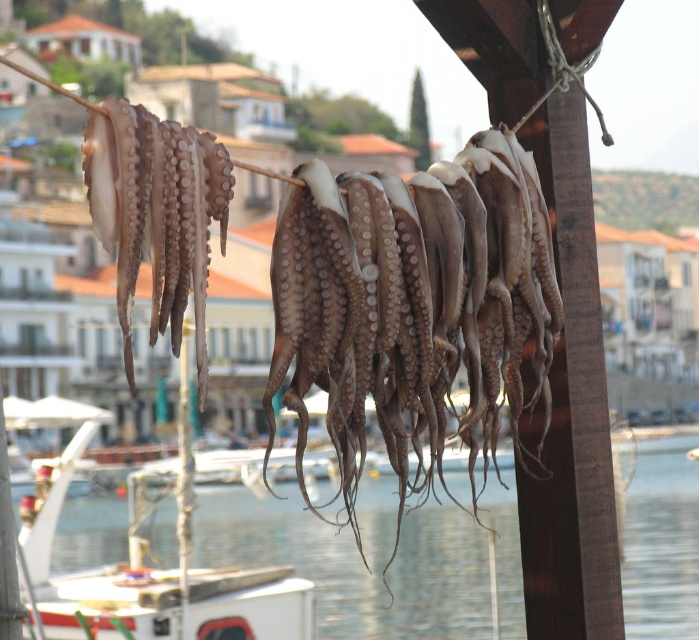
Question: Is brown matte squid at center smaller than brown matte squid at left?

Choices:
 (A) no
 (B) yes

Answer: (A)

Question: Does brown matte squid at center appear on the left side of translucent water at lower center?

Choices:
 (A) no
 (B) yes

Answer: (A)

Question: Which object is closer to the camera taking this photo?

Choices:
 (A) brown matte squid at center
 (B) brown matte squid at left
 (C) translucent water at lower center

Answer: (B)

Question: Considering the relative positions of brown matte squid at center and brown matte squid at left in the image provided, where is brown matte squid at center located with respect to brown matte squid at left?

Choices:
 (A) above
 (B) below

Answer: (B)

Question: Which object is positioned farthest from the brown matte squid at left?

Choices:
 (A) translucent water at lower center
 (B) brown matte squid at center

Answer: (A)

Question: Based on their relative distances, which object is farther from the translucent water at lower center?

Choices:
 (A) brown matte squid at left
 (B) brown matte squid at center

Answer: (A)